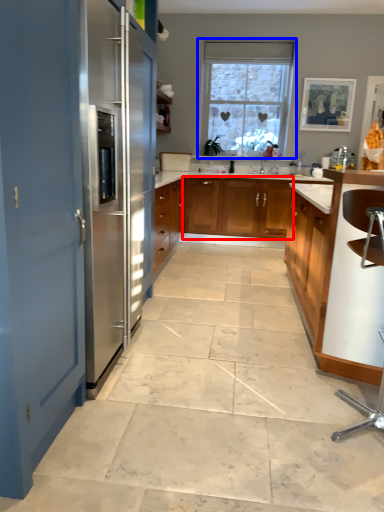
Question: Which object is further to the camera taking this photo, cabinetry (highlighted by a red box) or window (highlighted by a blue box)?

Choices:
 (A) cabinetry
 (B) window

Answer: (B)